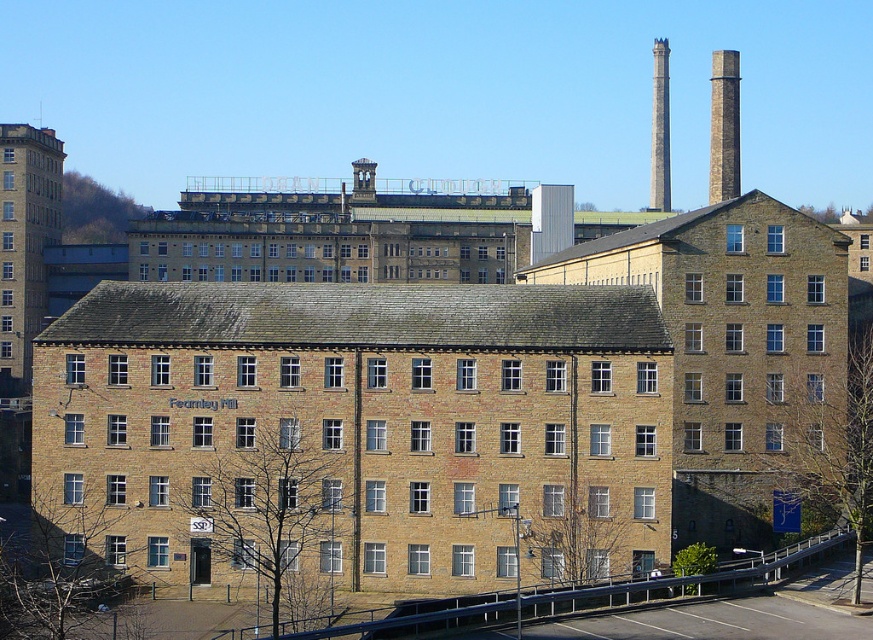
Question: Among these objects, which one is nearest to the camera?

Choices:
 (A) gray stone chimney at upper right
 (B) smooth gray chimney at upper right

Answer: (A)

Question: Does metallic rail at lower center have a greater width compared to gray stone chimney at upper right?

Choices:
 (A) no
 (B) yes

Answer: (A)

Question: Is metallic rail at lower center positioned in front of smooth gray chimney at upper right?

Choices:
 (A) yes
 (B) no

Answer: (A)

Question: Estimate the real-world distances between objects in this image. Which object is farther from the gray stone chimney at upper right?

Choices:
 (A) metallic rail at lower center
 (B) smooth gray chimney at upper right

Answer: (A)

Question: Does gray stone chimney at upper right appear on the right side of smooth gray chimney at upper right?

Choices:
 (A) no
 (B) yes

Answer: (B)

Question: Which point appears closest to the camera in this image?

Choices:
 (A) (665, 148)
 (B) (806, 561)

Answer: (B)